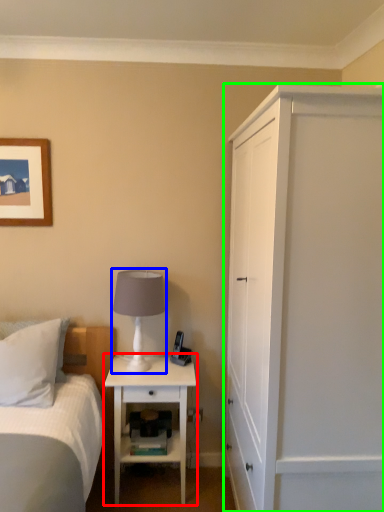
Question: Based on their relative distances, which object is nearer to nightstand (highlighted by a red box)? Choose from table lamp (highlighted by a blue box) and cabinetry (highlighted by a green box).

Choices:
 (A) table lamp
 (B) cabinetry

Answer: (A)